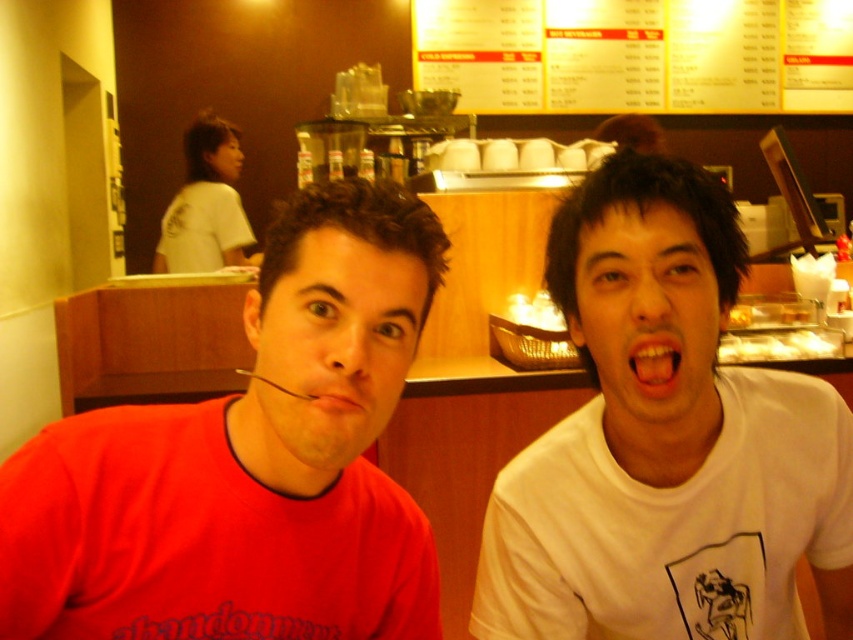
In the scene shown: You are a photographer trying to capture both the matte red shirt at center and the white matte shirt at upper left in a single frame. Based on their positions, which shirt appears smaller in the photo?

The matte red shirt at center appears smaller in the photo because it has a lesser height compared to the white matte shirt at upper left.

You are a photographer trying to adjust the lighting for a photo shoot. You notice the white matte shirt at right and the pink matte lips at center. Which object should you focus your spotlight on to ensure it reaches the taller one?

The white matte shirt at right is much taller than the pink matte lips at center, so you should focus the spotlight on the white matte shirt at right to ensure it reaches the taller one.

You are a photographer taking a group photo of the matte red shirt at center and the white matte shirt at upper left. To ensure both shirts are clearly visible, which shirt should you focus on first and why?

The matte red shirt at center has a smaller size compared to the white matte shirt at upper left. Therefore, you should focus on the matte red shirt at center first because it is smaller and might require more precise focusing to ensure its details are clear.